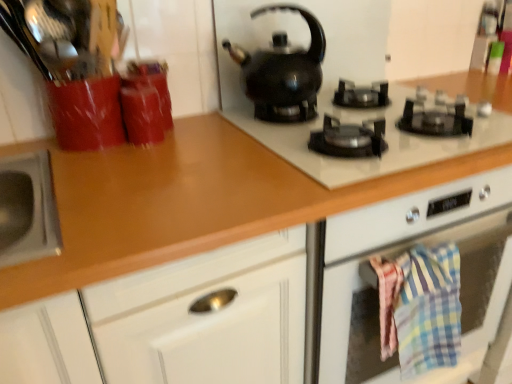
What are the coordinates of `empty space that is ontop of brown glossy countertop at center` in the screenshot? It's located at (135, 173).